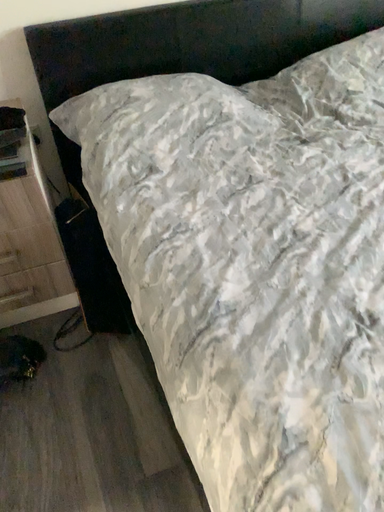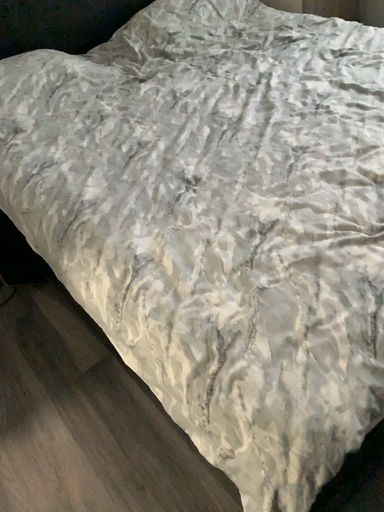
Question: How did the camera likely rotate when shooting the video?

Choices:
 (A) rotated left
 (B) rotated right

Answer: (B)